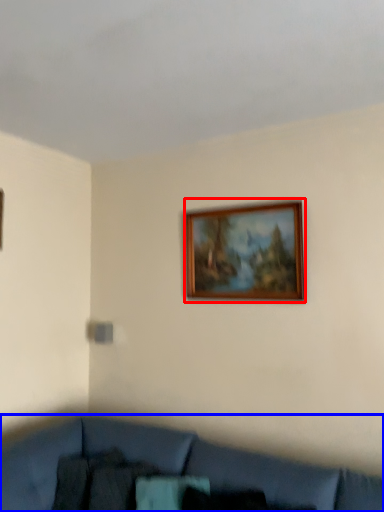
Question: Among these objects, which one is farthest to the camera, picture frame (highlighted by a red box) or studio couch (highlighted by a blue box)?

Choices:
 (A) picture frame
 (B) studio couch

Answer: (A)